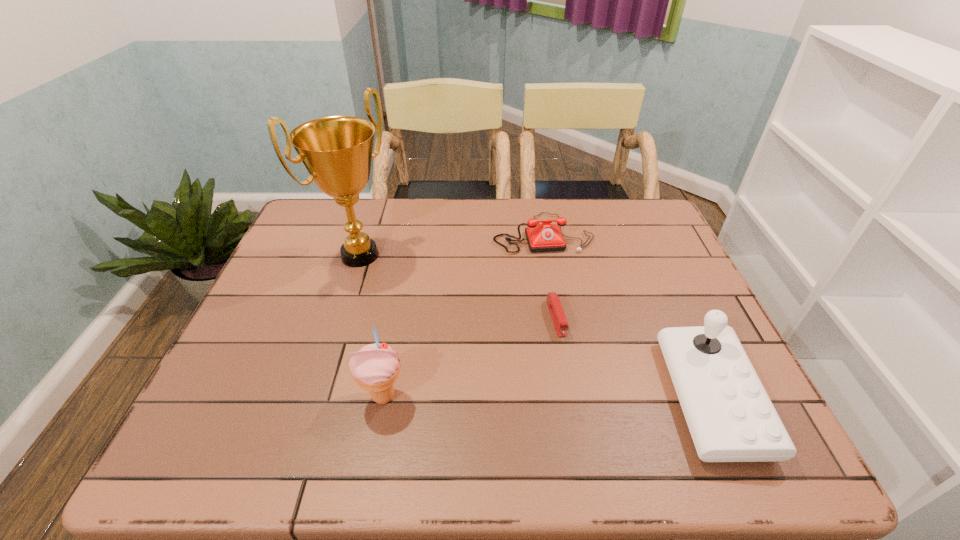
I want to click on joystick positioned at the near edge, so click(x=730, y=416).

Where is `object situated at the left edge`? object situated at the left edge is located at coordinates (337, 151).

This screenshot has width=960, height=540. Identify the location of object situated at the right edge. (730, 416).

Identify the location of object that is at the far left corner. (337, 151).

Find the location of a particular element. The height and width of the screenshot is (540, 960). object that is at the near right corner is located at coordinates (730, 416).

This screenshot has width=960, height=540. I want to click on vacant area at the far edge of the desktop, so click(x=556, y=202).

At what (x,y) coordinates should I click in order to perform the action: click on free location at the near edge of the desktop. Please return your answer as a coordinate pair (x, y). This screenshot has height=540, width=960. Looking at the image, I should click on (675, 409).

The width and height of the screenshot is (960, 540). In the image, there is a desktop. In order to click on vacant area at the left edge in this screenshot , I will do `click(295, 341)`.

In the image, there is a desktop. Where is `vacant space at the right edge`? The height and width of the screenshot is (540, 960). vacant space at the right edge is located at coordinates (646, 306).

Where is `free space at the far left corner of the desktop`? This screenshot has height=540, width=960. free space at the far left corner of the desktop is located at coordinates (308, 238).